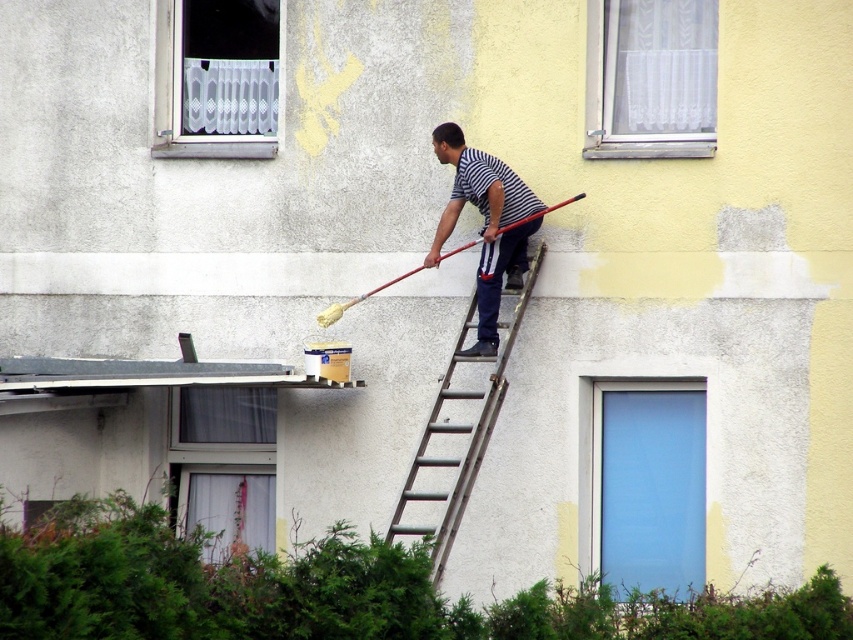
Is white sheer curtain at upper center further to camera compared to white lace curtain at upper left?

No, it is in front of white lace curtain at upper left.

Can you confirm if white sheer curtain at upper center is positioned to the right of white lace curtain at upper left?

Correct, you'll find white sheer curtain at upper center to the right of white lace curtain at upper left.

Is point (712, 45) less distant than point (264, 22)?

Yes, point (712, 45) is closer to viewer.

Find the location of a particular element. white sheer curtain at upper center is located at coordinates (650, 77).

Is transparent glass door at center further to the viewer compared to metallic silver ladder at center?

Yes, transparent glass door at center is further from the viewer.

Between transparent glass door at center and metallic silver ladder at center, which one is positioned lower?

transparent glass door at center is lower down.

Identify the location of transparent glass door at center. The image size is (853, 640). (648, 483).

Is transparent glass door at center below white lace curtain at upper left?

Yes, transparent glass door at center is below white lace curtain at upper left.

Locate an element on the screen. This screenshot has width=853, height=640. transparent glass door at center is located at coordinates (648, 483).